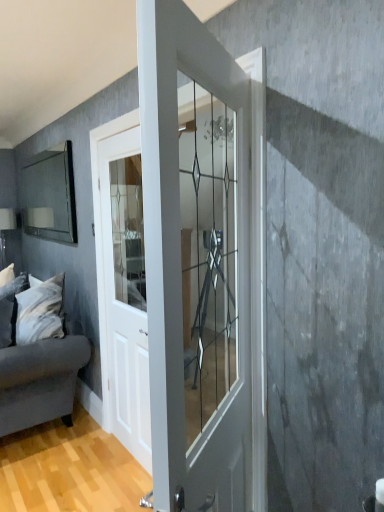
Locate an element on the screen. Image resolution: width=384 pixels, height=512 pixels. blank space situated above white glossy door at center, which is the 2th door in front-to-back order (from a real-world perspective) is located at coordinates (120, 134).